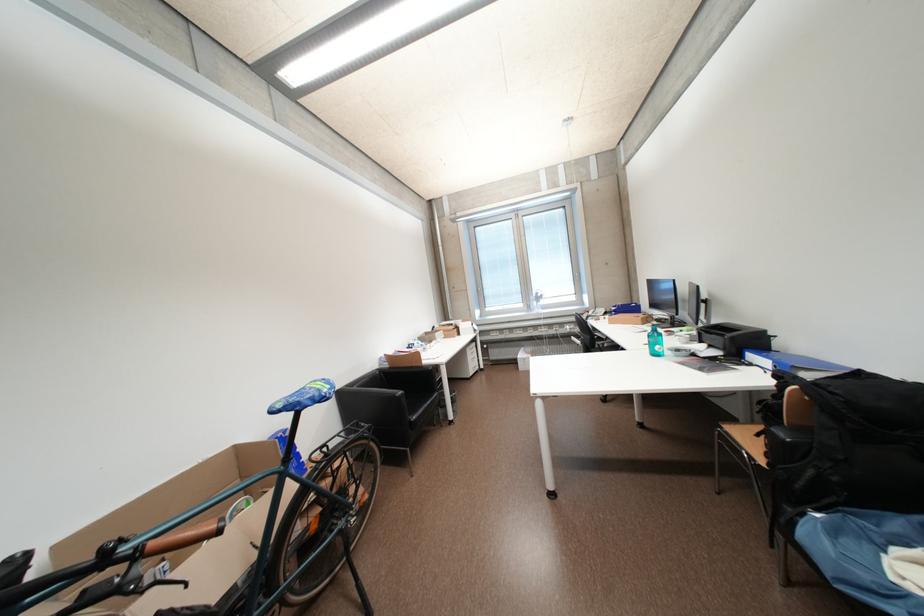
Image resolution: width=924 pixels, height=616 pixels. What do you see at coordinates (655, 342) in the screenshot? I see `the teal pump bottle top` at bounding box center [655, 342].